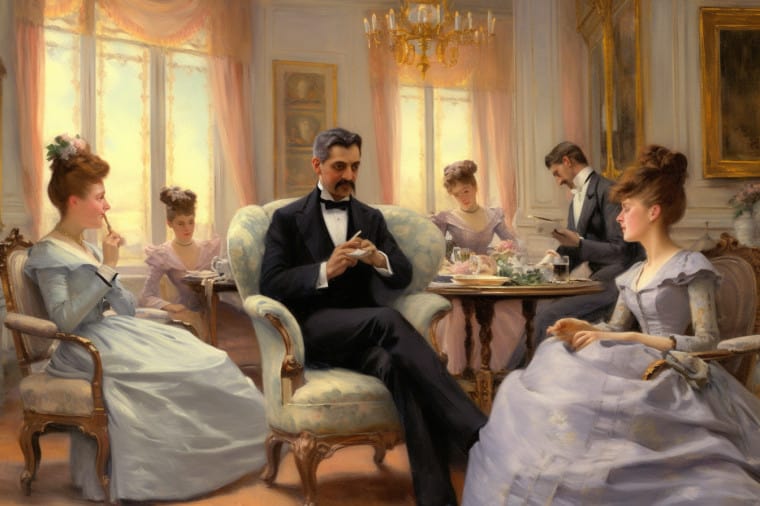
The image size is (760, 506). I want to click on curtains, so click(x=154, y=17), click(x=24, y=51), click(x=239, y=94), click(x=381, y=97), click(x=453, y=65).